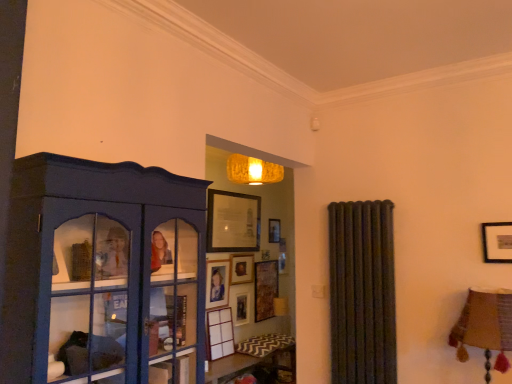
Image resolution: width=512 pixels, height=384 pixels. Describe the element at coordinates (233, 222) in the screenshot. I see `wooden picture frame at upper center, which ranks as the 5th picture frame in bottom-to-top order` at that location.

The image size is (512, 384). What do you see at coordinates (240, 308) in the screenshot?
I see `wooden picture frame at center, the 2th picture frame ordered from the bottom` at bounding box center [240, 308].

Find the location of a particular element. This screenshot has width=512, height=384. wooden picture frame at center, the 4th picture frame positioned from the bottom is located at coordinates (242, 269).

In terms of width, does white matte picture frame at center, acting as the 5th picture frame starting from the top, look wider or thinner when compared to matte blue cabinet at left?

white matte picture frame at center, acting as the 5th picture frame starting from the top, is thinner than matte blue cabinet at left.

Does point (228, 309) lie behind point (158, 333)?

Yes, point (228, 309) is farther from viewer.

Is white matte picture frame at center, acting as the 5th picture frame starting from the top, oriented away from matte blue cabinet at left?

That's not correct — white matte picture frame at center, acting as the 5th picture frame starting from the top, is not looking away from matte blue cabinet at left.

From a real-world perspective, is white matte picture frame at center, positioned as the 1th picture frame in bottom-to-top order, physically located above or below matte blue cabinet at left?

Clearly, from a real-world perspective, white matte picture frame at center, positioned as the 1th picture frame in bottom-to-top order, is below matte blue cabinet at left.

Considering the relative sizes of matte blue cabinet at left and matte black picture frame at center, the third picture frame viewed from the top, in the image provided, is matte blue cabinet at left wider than matte black picture frame at center, the third picture frame viewed from the top,?

Yes.

Can you tell me how much matte blue cabinet at left and matte black picture frame at center, the 3th picture frame from the bottom, differ in facing direction?

matte blue cabinet at left and matte black picture frame at center, the 3th picture frame from the bottom, are facing 1.56 degrees away from each other.

From a real-world perspective, does matte blue cabinet at left stand above matte black picture frame at center, the third picture frame viewed from the top?

Yes, from a real-world perspective, matte blue cabinet at left is above matte black picture frame at center, the third picture frame viewed from the top.

Is there a large distance between matte blue cabinet at left and matte black picture frame at center, the third picture frame viewed from the top?

Yes.

Between matte blue cabinet at left and wooden picture frame at center, arranged as the fourth picture frame when viewed from the top, which one has smaller width?

Thinner between the two is wooden picture frame at center, arranged as the fourth picture frame when viewed from the top.

Does point (11, 290) lie in front of point (244, 300)?

Yes, point (11, 290) is in front of point (244, 300).

How many degrees apart are the facing directions of matte blue cabinet at left and wooden picture frame at center, arranged as the fourth picture frame when viewed from the top?

The angular difference between matte blue cabinet at left and wooden picture frame at center, arranged as the fourth picture frame when viewed from the top, is 0.00508 degrees.

In order to click on the 3rd picture frame below the wooden picture frame at center, which is counted as the second picture frame, starting from the top (from the image's perspective) in this screenshot , I will do `click(219, 333)`.

Which is nearer, [238,273] or [225,326]?

Clearly, point [238,273] is more distant from the camera than point [225,326].

Is wooden picture frame at center, the 4th picture frame positioned from the bottom, beside white matte picture frame at center, acting as the 5th picture frame starting from the top?

No, wooden picture frame at center, the 4th picture frame positioned from the bottom, is not beside white matte picture frame at center, acting as the 5th picture frame starting from the top.

Can you confirm if wooden picture frame at center, which is counted as the second picture frame, starting from the top, is shorter than white matte picture frame at center, positioned as the 1th picture frame in bottom-to-top order?

Yes.

Which of these two, wooden picture frame at upper center, which ranks as the 5th picture frame in bottom-to-top order, or matte blue cabinet at left, is smaller?

Smaller between the two is wooden picture frame at upper center, which ranks as the 5th picture frame in bottom-to-top order.

Does wooden picture frame at upper center, arranged as the first picture frame when viewed from the top, touch matte blue cabinet at left?

They are not placed beside each other.

At what (x,y) coordinates should I click in order to perform the action: click on shelf on the left of wooden picture frame at upper center, arranged as the first picture frame when viewed from the top. Please return your answer as a coordinate pair (x, y). The height and width of the screenshot is (384, 512). Looking at the image, I should click on (103, 274).

Would you say wooden picture frame at upper center, which ranks as the 5th picture frame in bottom-to-top order, is outside matte blue cabinet at left?

Indeed, wooden picture frame at upper center, which ranks as the 5th picture frame in bottom-to-top order, is completely outside matte blue cabinet at left.

Considering the positions of points (222, 211) and (234, 277), is point (222, 211) closer to camera compared to point (234, 277)?

That is True.

Does wooden picture frame at upper center, which ranks as the 5th picture frame in bottom-to-top order, have a smaller size compared to wooden picture frame at center, the 4th picture frame positioned from the bottom?

Incorrect, wooden picture frame at upper center, which ranks as the 5th picture frame in bottom-to-top order, is not smaller in size than wooden picture frame at center, the 4th picture frame positioned from the bottom.

Is wooden picture frame at upper center, arranged as the first picture frame when viewed from the top, inside or outside of wooden picture frame at center, the 4th picture frame positioned from the bottom?

wooden picture frame at upper center, arranged as the first picture frame when viewed from the top, is not inside wooden picture frame at center, the 4th picture frame positioned from the bottom, it's outside.

Based on the photo, which is more to the left, wooden picture frame at upper center, which ranks as the 5th picture frame in bottom-to-top order, or wooden picture frame at center, which is counted as the second picture frame, starting from the top?

From the viewer's perspective, wooden picture frame at upper center, which ranks as the 5th picture frame in bottom-to-top order, appears more on the left side.

Is there a large distance between white matte picture frame at center, positioned as the 1th picture frame in bottom-to-top order, and wooden picture frame at center, which is counted as the second picture frame, starting from the top?

That's not correct — white matte picture frame at center, positioned as the 1th picture frame in bottom-to-top order, is a little close to wooden picture frame at center, which is counted as the second picture frame, starting from the top.

Locate an element on the screen. The image size is (512, 384). picture frame that is the 2nd one when counting rightward from the white matte picture frame at center, acting as the 5th picture frame starting from the top is located at coordinates coord(242,269).

Between white matte picture frame at center, acting as the 5th picture frame starting from the top, and wooden picture frame at center, the 4th picture frame positioned from the bottom, which one appears on the right side from the viewer's perspective?

Positioned to the right is wooden picture frame at center, the 4th picture frame positioned from the bottom.

Locate an element on the screen. The width and height of the screenshot is (512, 384). shelf in front of the white matte picture frame at center, positioned as the 1th picture frame in bottom-to-top order is located at coordinates (103, 274).

Where is `the 2nd picture frame to the left of the matte blue cabinet at left, counting from the anchor's position`? the 2nd picture frame to the left of the matte blue cabinet at left, counting from the anchor's position is located at coordinates point(217,283).

Considering their positions, is wooden picture frame at center, the 2th picture frame ordered from the bottom, positioned closer to matte black picture frame at center, the 3th picture frame from the bottom, than wooden picture frame at center, the 4th picture frame positioned from the bottom?

wooden picture frame at center, the 4th picture frame positioned from the bottom, lies closer to matte black picture frame at center, the 3th picture frame from the bottom, than the other object.

Based on their spatial positions, is matte blue cabinet at left or wooden picture frame at upper center, which ranks as the 5th picture frame in bottom-to-top order, further from wooden picture frame at center, which is counted as the second picture frame, starting from the top?

Among the two, matte blue cabinet at left is located further to wooden picture frame at center, which is counted as the second picture frame, starting from the top.

From the picture: Which object lies further to the anchor point matte black picture frame at center, the third picture frame viewed from the top, wooden picture frame at center, which is counted as the second picture frame, starting from the top, or wooden picture frame at upper center, arranged as the first picture frame when viewed from the top?

Based on the image, wooden picture frame at upper center, arranged as the first picture frame when viewed from the top, appears to be further to matte black picture frame at center, the third picture frame viewed from the top.

Considering their positions, is matte black picture frame at center, the 3th picture frame from the bottom, positioned further to wooden picture frame at center, the 2th picture frame ordered from the bottom, than wooden picture frame at upper center, arranged as the first picture frame when viewed from the top?

Among the two, wooden picture frame at upper center, arranged as the first picture frame when viewed from the top, is located further to wooden picture frame at center, the 2th picture frame ordered from the bottom.

Looking at the image, which one is located closer to wooden picture frame at center, arranged as the fourth picture frame when viewed from the top, wooden picture frame at upper center, which ranks as the 5th picture frame in bottom-to-top order, or white matte picture frame at center, positioned as the 1th picture frame in bottom-to-top order?

white matte picture frame at center, positioned as the 1th picture frame in bottom-to-top order, is positioned closer to the anchor wooden picture frame at center, arranged as the fourth picture frame when viewed from the top.

Looking at the image, which one is located closer to matte black picture frame at center, the third picture frame viewed from the top, matte blue cabinet at left or wooden picture frame at center, the 4th picture frame positioned from the bottom?

wooden picture frame at center, the 4th picture frame positioned from the bottom, is positioned closer to the anchor matte black picture frame at center, the third picture frame viewed from the top.

Looking at the image, which one is located further to white matte picture frame at center, acting as the 5th picture frame starting from the top, matte blue cabinet at left or matte black picture frame at center, the 3th picture frame from the bottom?

matte blue cabinet at left lies further to white matte picture frame at center, acting as the 5th picture frame starting from the top, than the other object.

From the image, which object appears to be farther from white matte picture frame at center, acting as the 5th picture frame starting from the top, wooden picture frame at upper center, arranged as the first picture frame when viewed from the top, or wooden picture frame at center, the 4th picture frame positioned from the bottom?

Based on the image, wooden picture frame at upper center, arranged as the first picture frame when viewed from the top, appears to be further to white matte picture frame at center, acting as the 5th picture frame starting from the top.

You are a GUI agent. You are given a task and a screenshot of the screen. Output one action in this format:
    pyautogui.click(x=<x>, y=<y>)
    Task: Click on the picture frame between wooden picture frame at center, which is counted as the second picture frame, starting from the top, and wooden picture frame at center, arranged as the fourth picture frame when viewed from the top, in the vertical direction
    The height and width of the screenshot is (384, 512).
    Given the screenshot: What is the action you would take?
    pyautogui.click(x=217, y=283)

Find the location of `picture frame between wooden picture frame at upper center, which ranks as the 5th picture frame in bottom-to-top order, and matte black picture frame at center, the 3th picture frame from the bottom, from top to bottom`. picture frame between wooden picture frame at upper center, which ranks as the 5th picture frame in bottom-to-top order, and matte black picture frame at center, the 3th picture frame from the bottom, from top to bottom is located at coordinates (242, 269).

This screenshot has width=512, height=384. Identify the location of picture frame between matte blue cabinet at left and matte black picture frame at center, the third picture frame viewed from the top, from front to back. (219, 333).

This screenshot has width=512, height=384. I want to click on picture frame between matte black picture frame at center, the third picture frame viewed from the top, and white matte picture frame at center, positioned as the 1th picture frame in bottom-to-top order, in the vertical direction, so click(240, 308).